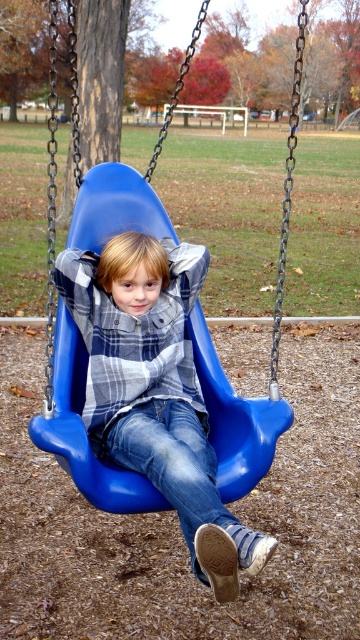
You are a photographer aiming to capture the child in the blue plastic swing at center while ensuring the plaid shirt at center is visible in the shot. Based on their positions, should you position yourself to the right or left of the swing to include both elements in the frame?

Since the plaid shirt at center is to the left of the blue plastic swing at center, you should position yourself to the left of the swing to ensure both the swing and the plaid shirt are visible in the frame.